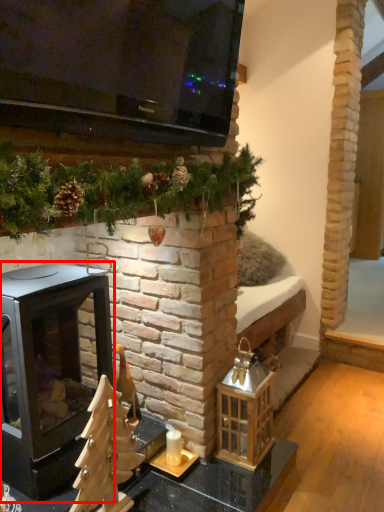
Question: From the image, what is the correct spatial relationship of wood burning stove (annotated by the red box) in relation to candle holder?

Choices:
 (A) right
 (B) left

Answer: (B)